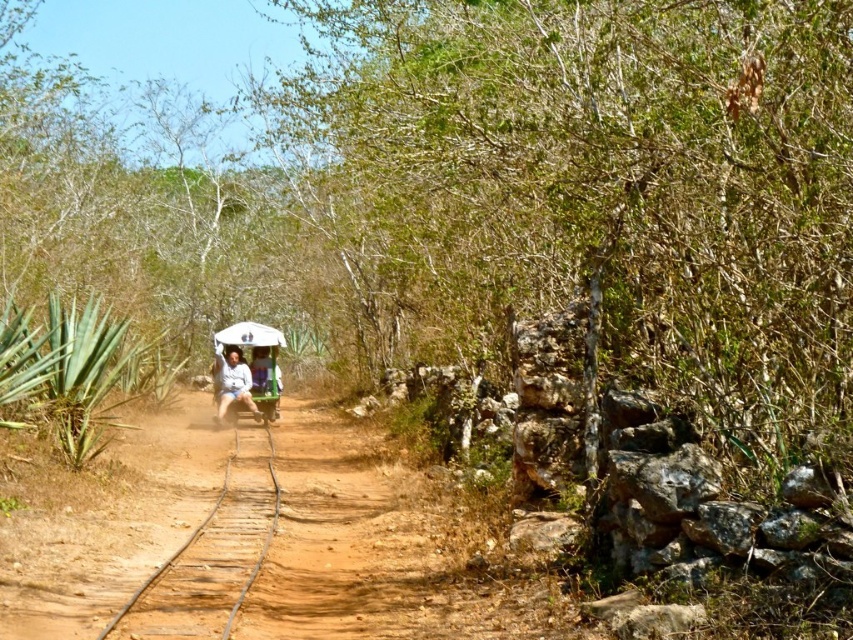
Which is more to the left, brown wooden train track at center or white matte umbrella at center?

Positioned to the left is white matte umbrella at center.

Does brown wooden train track at center appear under white matte umbrella at center?

Indeed, brown wooden train track at center is positioned under white matte umbrella at center.

In order to click on brown wooden train track at center in this screenshot , I will do pyautogui.click(x=177, y=548).

The height and width of the screenshot is (640, 853). I want to click on brown wooden train track at center, so click(177, 548).

How far apart are brown wooden train track at center and light blue fabric umbrella at center?

brown wooden train track at center is 6.97 feet away from light blue fabric umbrella at center.

Measure the distance between brown wooden train track at center and light blue fabric umbrella at center.

brown wooden train track at center and light blue fabric umbrella at center are 2.12 meters apart.

Between point (262, 554) and point (236, 352), which one is positioned in front?

Point (262, 554)

The image size is (853, 640). Find the location of `brown wooden train track at center`. brown wooden train track at center is located at coordinates (177, 548).

Consider the image. Between light blue fabric umbrella at center and white matte umbrella at center, which one is positioned lower?

light blue fabric umbrella at center is below.

The height and width of the screenshot is (640, 853). Describe the element at coordinates (233, 381) in the screenshot. I see `light blue fabric umbrella at center` at that location.

Between point (219, 397) and point (265, 342), which one is positioned in front?

Point (219, 397) is more forward.

You are a GUI agent. You are given a task and a screenshot of the screen. Output one action in this format:
    pyautogui.click(x=<x>, y=<y>)
    Task: Click on the light blue fabric umbrella at center
    Image resolution: width=853 pixels, height=640 pixels.
    Given the screenshot: What is the action you would take?
    pyautogui.click(x=233, y=381)